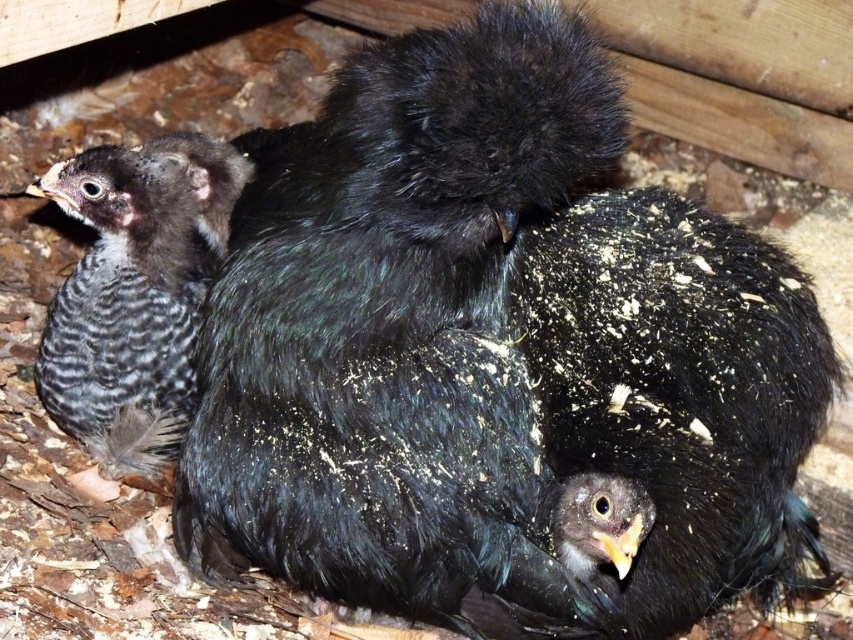
You are a farmer checking on your poultry. You see the black fluffy bird at center and the speckled feathered chick at left. Which one is taller?

The black fluffy bird at center is taller than the speckled feathered chick at left.

You are a farmer checking the coop. You see a point marked at coordinates (407, 340). What animal is located at that point?

The point at coordinates (407, 340) indicates a black fluffy bird at center, which is the mother hen protecting her chicks.

You are standing 1.5 meters away from the image. Is the point at coordinates point (467, 164) closer to you than the hen?

The point point (467, 164) is 1.32 meters from the viewer. Since you are standing 1.5 meters away from the image, the point is closer to you than the hen because it is positioned at a shorter distance.